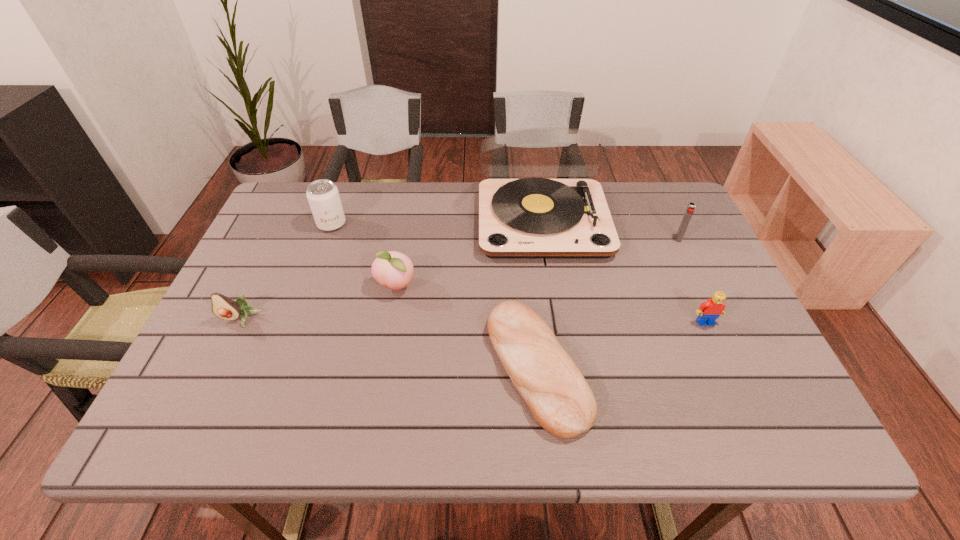
You are a GUI agent. You are given a task and a screenshot of the screen. Output one action in this format:
    pyautogui.click(x=<x>, y=<y>)
    Task: Click on the empty space that is in between the shortest object and the record player
    
    Given the screenshot: What is the action you would take?
    pyautogui.click(x=540, y=294)

Where is `empty location between the record player and the shortest object`? empty location between the record player and the shortest object is located at coordinates (540, 294).

Where is `vacant point located between the fifth object from right to left and the shortest object`? This screenshot has width=960, height=540. vacant point located between the fifth object from right to left and the shortest object is located at coordinates (467, 327).

Identify the location of free spot between the bread and the avocado. This screenshot has height=540, width=960. (389, 343).

Identify the location of vacant space in between the shortest object and the tallest object. (540, 294).

Where is `vacant space in between the shortest object and the tallest object`? The image size is (960, 540). vacant space in between the shortest object and the tallest object is located at coordinates (540, 294).

At what (x,y) coordinates should I click in order to perform the action: click on vacant space that is in between the record player and the second object from left to right. Please return your answer as a coordinate pair (x, y). The height and width of the screenshot is (540, 960). Looking at the image, I should click on (437, 222).

Identify the location of the closest object to the record player. The height and width of the screenshot is (540, 960). (561, 401).

Select which object is the fourth closest to the Lego. Please provide its 2D coordinates. Your answer should be formatted as a tuple, i.e. [(x, y)], where the tuple contains the x and y coordinates of a point satisfying the conditions above.

[(392, 269)]

I want to click on vacant area that satisfies the following two spatial constraints: 1. on the back side of the igniter; 2. on the left side of the peach, so click(404, 239).